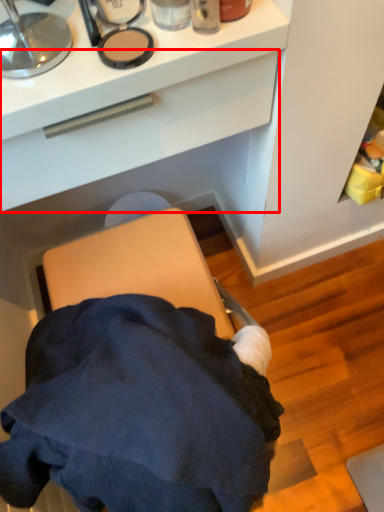
Question: Considering the relative positions of drawer (annotated by the red box) and toiletry in the image provided, where is drawer (annotated by the red box) located with respect to the staircase?

Choices:
 (A) right
 (B) left

Answer: (B)